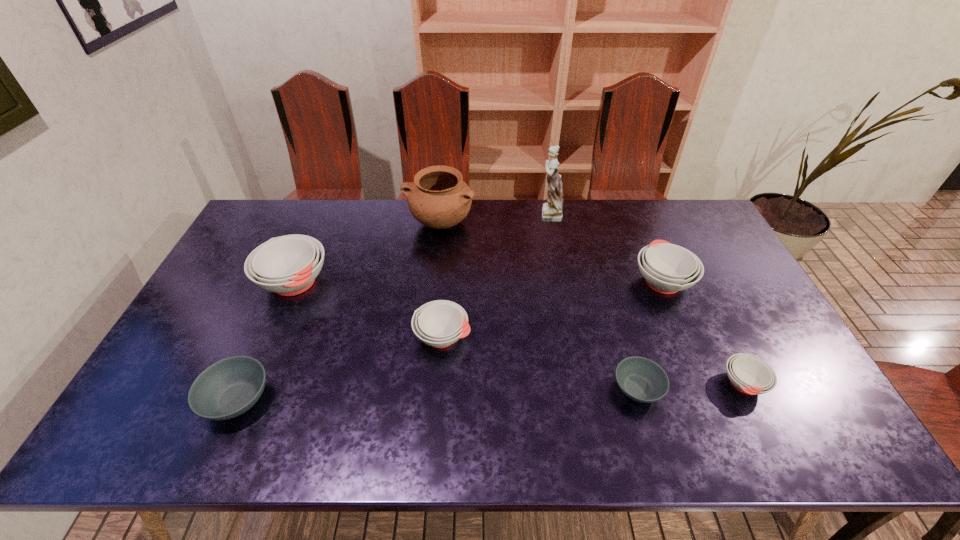
Where is `figurine`? Image resolution: width=960 pixels, height=540 pixels. figurine is located at coordinates (552, 211).

Image resolution: width=960 pixels, height=540 pixels. What are the coordinates of `the tallest object` in the screenshot? It's located at (552, 211).

Find the location of a particular element. This screenshot has width=960, height=540. the seventh shortest object is located at coordinates (438, 198).

The height and width of the screenshot is (540, 960). Find the location of `pottery`. pottery is located at coordinates (438, 198).

Locate an element on the screen. The height and width of the screenshot is (540, 960). the tallest soup bowl is located at coordinates (287, 265).

You are a GUI agent. You are given a task and a screenshot of the screen. Output one action in this format:
    pyautogui.click(x=<x>, y=<y>)
    Task: Click on the sixth shortest object
    
    Given the screenshot: What is the action you would take?
    pyautogui.click(x=287, y=265)

Locate an element on the screen. The width and height of the screenshot is (960, 540). the second biggest white soup bowl is located at coordinates (667, 268).

Find the location of a particular element. Image resolution: width=960 pixels, height=540 pixels. the fourth tallest object is located at coordinates (667, 268).

This screenshot has height=540, width=960. I want to click on the second nearest white soup bowl, so click(440, 323).

The image size is (960, 540). Identify the location of the second smallest white soup bowl. (440, 323).